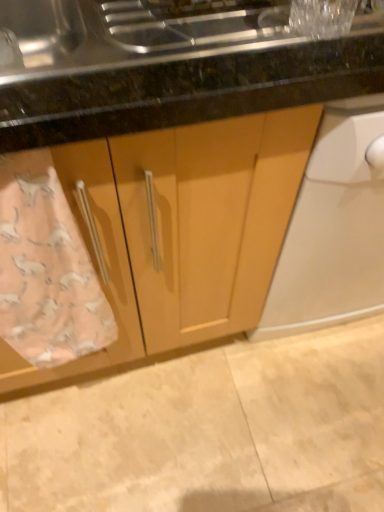
Describe the element at coordinates (134, 442) in the screenshot. I see `beige tile floor at lower center` at that location.

The width and height of the screenshot is (384, 512). In order to click on pink fabric towel at lower left in this screenshot , I will do `click(46, 268)`.

In order to face pink fabric towel at lower left, should I rotate leftwards or rightwards?

You should look left and rotate roughly 21.589 degrees.

The width and height of the screenshot is (384, 512). Describe the element at coordinates (185, 230) in the screenshot. I see `matte wood cabinet at center` at that location.

Where is `beige tile floor at lower center`? The height and width of the screenshot is (512, 384). beige tile floor at lower center is located at coordinates (134, 442).

Do you think pink fabric towel at lower left is within beige tile floor at lower center, or outside of it?

pink fabric towel at lower left cannot be found inside beige tile floor at lower center.

How far apart are pink fabric towel at lower left and beige tile floor at lower center?

pink fabric towel at lower left and beige tile floor at lower center are 18.34 inches apart.

Consider the image. From the image's perspective, which one is positioned lower, pink fabric towel at lower left or beige tile floor at lower center?

beige tile floor at lower center, from the image's perspective.

Does pink fabric towel at lower left appear on the right side of beige tile floor at lower center?

In fact, pink fabric towel at lower left is to the left of beige tile floor at lower center.

Is beige tile floor at lower center not within matte wood cabinet at center?

Yes, beige tile floor at lower center is not within matte wood cabinet at center.

What's the angular difference between beige tile floor at lower center and matte wood cabinet at center's facing directions?

beige tile floor at lower center and matte wood cabinet at center are facing 89.5 degrees away from each other.

Does beige tile floor at lower center touch matte wood cabinet at center?

beige tile floor at lower center and matte wood cabinet at center are not in contact.

Can you confirm if matte wood cabinet at center is smaller than beige tile floor at lower center?

No.

From the image's perspective, which is below, matte wood cabinet at center or beige tile floor at lower center?

beige tile floor at lower center, from the image's perspective.

Which of these two, matte wood cabinet at center or beige tile floor at lower center, stands taller?

matte wood cabinet at center.

Based on the photo, from a real-world perspective, which object stands above the other?

matte wood cabinet at center.

Are matte wood cabinet at center and pink fabric towel at lower left making contact?

No, matte wood cabinet at center is not making contact with pink fabric towel at lower left.

From a real-world perspective, which object rests below the other?

From a 3D spatial view, matte wood cabinet at center is below.

Identify the location of bath towel that appears on the left of matte wood cabinet at center. Image resolution: width=384 pixels, height=512 pixels. (46, 268).

How many degrees apart are the facing directions of matte wood cabinet at center and pink fabric towel at lower left?

matte wood cabinet at center and pink fabric towel at lower left are facing 0.000238 degrees away from each other.

Which object is positioned more to the left, beige tile floor at lower center or pink fabric towel at lower left?

pink fabric towel at lower left.

The height and width of the screenshot is (512, 384). Find the location of `bath towel located above the beige tile floor at lower center (from a real-world perspective)`. bath towel located above the beige tile floor at lower center (from a real-world perspective) is located at coordinates (46, 268).

Does beige tile floor at lower center have a lesser height compared to pink fabric towel at lower left?

Indeed, beige tile floor at lower center has a lesser height compared to pink fabric towel at lower left.

Which point is more distant from viewer, (141, 381) or (85, 329)?

Positioned behind is point (141, 381).

How different are the orientations of pink fabric towel at lower left and matte wood cabinet at center in degrees?

The angular difference between pink fabric towel at lower left and matte wood cabinet at center is 0.000238 degrees.

How distant is pink fabric towel at lower left from matte wood cabinet at center?

The distance of pink fabric towel at lower left from matte wood cabinet at center is 5.83 inches.

From the image's perspective, is pink fabric towel at lower left on top of matte wood cabinet at center?

No, from the image's perspective, pink fabric towel at lower left is not over matte wood cabinet at center.

From a real-world perspective, between pink fabric towel at lower left and matte wood cabinet at center, who is vertically higher?

From a 3D spatial view, pink fabric towel at lower left is above.

Locate an element on the screen. The height and width of the screenshot is (512, 384). bath towel above the beige tile floor at lower center (from a real-world perspective) is located at coordinates point(46,268).

The height and width of the screenshot is (512, 384). What are the coordinates of `cabinetry located in front of the beige tile floor at lower center` in the screenshot? It's located at (185, 230).

From the image, which object appears to be nearer to beige tile floor at lower center, matte wood cabinet at center or pink fabric towel at lower left?

matte wood cabinet at center.

When comparing their distances from matte wood cabinet at center, does beige tile floor at lower center or pink fabric towel at lower left seem further?

beige tile floor at lower center lies further to matte wood cabinet at center than the other object.

Looking at the image, which one is located further to beige tile floor at lower center, pink fabric towel at lower left or matte wood cabinet at center?

pink fabric towel at lower left.

Looking at this image, considering their positions, is matte wood cabinet at center positioned closer to pink fabric towel at lower left than beige tile floor at lower center?

The object closer to pink fabric towel at lower left is matte wood cabinet at center.

Considering their positions, is beige tile floor at lower center positioned further to pink fabric towel at lower left than matte wood cabinet at center?

Based on the image, beige tile floor at lower center appears to be further to pink fabric towel at lower left.

Which object lies nearer to the anchor point matte wood cabinet at center, pink fabric towel at lower left or beige tile floor at lower center?

pink fabric towel at lower left lies closer to matte wood cabinet at center than the other object.

This screenshot has width=384, height=512. Find the location of `bath towel that lies between matte wood cabinet at center and beige tile floor at lower center from top to bottom`. bath towel that lies between matte wood cabinet at center and beige tile floor at lower center from top to bottom is located at coordinates (46, 268).